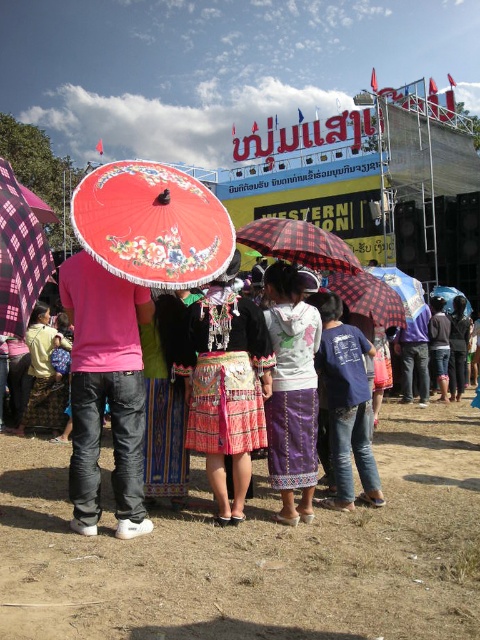
You are standing at the center of the event area and see the red plaid umbrella at center. Can you confirm if the red plaid umbrella at center is exactly at the point marked as coordinates (299, 243)?

Yes, the red plaid umbrella at center is exactly located at the point marked as coordinates (299, 243).

You are a photographer standing at the event and want to capture a clear photo of the red plaid umbrella at center. Considering the distance, do you think you can take a clear photo without zooming in?

The red plaid umbrella at center is 41.16 meters away from the camera. At this distance, taking a clear photo without zooming in may be challenging as the subject might appear small and blurry in the frame.

You are standing in the crowd at the event and want to take a photo of both the red plaid umbrella at center and the checkered fabric umbrella at center. Which umbrella should you focus on first to ensure both are in the frame?

You should focus on the red plaid umbrella at center first because it is closer to the viewer, allowing you to adjust the camera to include both the closer red plaid umbrella at center and the farther checkered fabric umbrella at center in the frame.